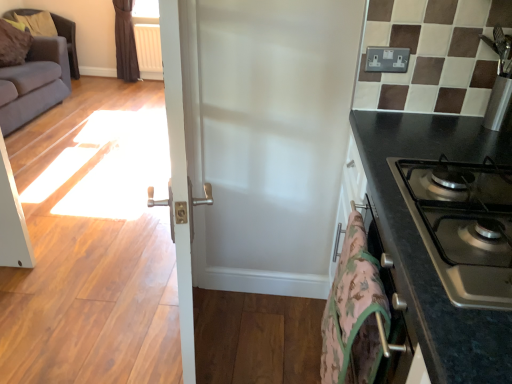
Question: In the image, is stainless steel gas stove at right on the left side or the right side of black granite countertop at right?

Choices:
 (A) left
 (B) right

Answer: (A)

Question: Considering the positions of stainless steel gas stove at right and black granite countertop at right in the image, is stainless steel gas stove at right taller or shorter than black granite countertop at right?

Choices:
 (A) short
 (B) tall

Answer: (A)

Question: Which is nearer to the white glossy door at center?

Choices:
 (A) black granite countertop at right
 (B) dark gray fabric armchair at upper left
 (C) gray fabric couch at left
 (D) stainless steel gas stove at right
 (E) white plastic radiator at upper left

Answer: (D)

Question: Based on their relative distances, which object is nearer to the black granite countertop at right?

Choices:
 (A) stainless steel gas stove at right
 (B) gray fabric couch at left
 (C) white plastic radiator at upper left
 (D) camouflage fabric blanket at lower right
 (E) dark gray fabric armchair at upper left

Answer: (A)